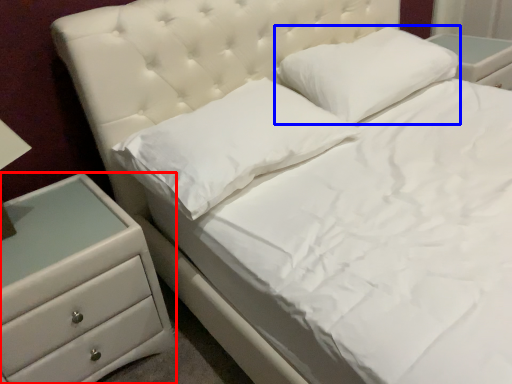
Question: Which of the following is the farthest to the observer, chest of drawers (highlighted by a red box) or pillow (highlighted by a blue box)?

Choices:
 (A) chest of drawers
 (B) pillow

Answer: (B)